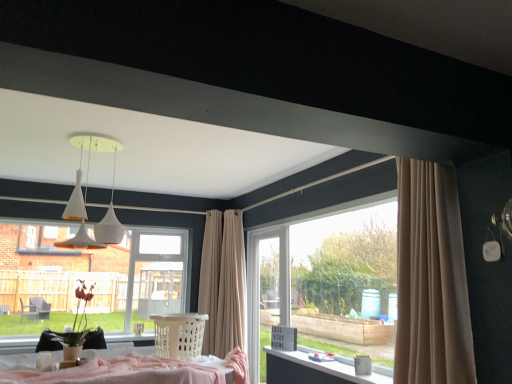
Identify the location of clear glass window at center. The width and height of the screenshot is (512, 384). (89, 278).

This screenshot has height=384, width=512. Describe the element at coordinates (223, 282) in the screenshot. I see `beige fabric curtain at center` at that location.

The image size is (512, 384). Find the location of `white plastic laundry basket at center`. white plastic laundry basket at center is located at coordinates (179, 335).

Looking at this image, what is the approximate width of white glossy table at lower right?

The width of white glossy table at lower right is 9.20 inches.

You are a GUI agent. You are given a task and a screenshot of the screen. Output one action in this format:
    pyautogui.click(x=<x>, y=<y>)
    Task: Click on the clear glass window at center
    The height and width of the screenshot is (384, 512).
    Given the screenshot: What is the action you would take?
    pyautogui.click(x=89, y=278)

From the image's perspective, is white plastic laundry basket at center on clear glass window at center?

No, from the image's perspective, white plastic laundry basket at center is not over clear glass window at center.

Consider the image. Which of these two, white plastic laundry basket at center or clear glass window at center, is bigger?

clear glass window at center is bigger.

Does white plastic laundry basket at center have a greater height compared to clear glass window at center?

No, white plastic laundry basket at center is not taller than clear glass window at center.

Is white plastic laundry basket at center looking in the opposite direction of clear glass window at center?

Absolutely, white plastic laundry basket at center is directed away from clear glass window at center.

Is white glossy table at lower right not near white plastic laundry basket at center?

Yes.

From the image's perspective, between white glossy table at lower right and white plastic laundry basket at center, who is located below?

white glossy table at lower right, from the image's perspective.

Is point (378, 378) positioned behind point (176, 347)?

No, (378, 378) is closer to viewer.

Consider the image. Would you say beige fabric curtain at center is outside white matte pendant lights at upper center?

That's correct, beige fabric curtain at center is outside of white matte pendant lights at upper center.

What's the angular difference between beige fabric curtain at center and white matte pendant lights at upper center's facing directions?

87.7 degrees.

From a real-world perspective, is beige fabric curtain at center above or below white matte pendant lights at upper center?

In terms of real-world spatial position, beige fabric curtain at center is below white matte pendant lights at upper center.

Who is taller, beige fabric curtain at center or white matte pendant lights at upper center?

With more height is beige fabric curtain at center.

Between white matte pendant lights at upper center and white glossy screen door at center, which one has larger size?

Answer: white matte pendant lights at upper center.

Can you confirm if white matte pendant lights at upper center is shorter than white glossy screen door at center?

Yes, white matte pendant lights at upper center is shorter than white glossy screen door at center.

In the scene shown: How different are the orientations of white matte pendant lights at upper center and white glossy screen door at center in degrees?

88.7 degrees separate the facing orientations of white matte pendant lights at upper center and white glossy screen door at center.

Would you say white matte pendant lights at upper center is to the left or to the right of white glossy screen door at center in the picture?

white matte pendant lights at upper center is to the left of white glossy screen door at center.

Is the surface of white glossy screen door at center in direct contact with white matte pendant lights at upper center?

There is a gap between white glossy screen door at center and white matte pendant lights at upper center.

At what (x,y) coordinates should I click in order to perform the action: click on screen door lying behind the white matte pendant lights at upper center. Please return your answer as a coordinate pair (x, y). Looking at the image, I should click on (262, 288).

Would you say white matte pendant lights at upper center is part of white glossy screen door at center's contents?

No, white matte pendant lights at upper center is not inside white glossy screen door at center.

From a real-world perspective, which object rests below the other?

In real-world perspective, white glossy screen door at center is lower.

Does clear glass window at center have a larger size compared to white plastic laundry basket at center?

Yes, clear glass window at center is bigger than white plastic laundry basket at center.

Is clear glass window at center touching white plastic laundry basket at center?

No.

Which object is thinner, clear glass window at center or white plastic laundry basket at center?

Thinner between the two is clear glass window at center.

Between white plastic laundry basket at center and beige fabric curtain at center, which one appears on the right side from the viewer's perspective?

From the viewer's perspective, beige fabric curtain at center appears more on the right side.

How much distance is there between white plastic laundry basket at center and beige fabric curtain at center?

white plastic laundry basket at center is 4.66 feet from beige fabric curtain at center.

Is point (183, 317) in front of point (240, 258)?

Yes, point (183, 317) is in front of point (240, 258).

Is white plastic laundry basket at center inside or outside of beige fabric curtain at center?

white plastic laundry basket at center exists outside the volume of beige fabric curtain at center.

The image size is (512, 384). Find the location of `furniture below the clear glass window at center (from the image's perspective)`. furniture below the clear glass window at center (from the image's perspective) is located at coordinates (179, 335).

This screenshot has width=512, height=384. Identify the location of table on the right of white plastic laundry basket at center. (317, 369).

When comparing their distances from beige fabric curtain at center, does white glossy screen door at center or white glossy table at lower right seem closer?

white glossy screen door at center is positioned closer to the anchor beige fabric curtain at center.

Which object lies nearer to the anchor point beige fabric curtain at center, clear glass window at center or white glossy screen door at center?

Among the two, white glossy screen door at center is located nearer to beige fabric curtain at center.

Estimate the real-world distances between objects in this image. Which object is further from white plastic laundry basket at center, white glossy screen door at center or beige fabric curtain at center?

Based on the image, beige fabric curtain at center appears to be further to white plastic laundry basket at center.

When comparing their distances from white plastic laundry basket at center, does beige fabric curtain at center or white glossy table at lower right seem closer?

white glossy table at lower right lies closer to white plastic laundry basket at center than the other object.

Considering their positions, is white plastic laundry basket at center positioned further to clear glass window at center than beige fabric curtain at center?

beige fabric curtain at center.

Estimate the real-world distances between objects in this image. Which object is closer to white glossy table at lower right, white plastic laundry basket at center or clear glass window at center?

The object closer to white glossy table at lower right is white plastic laundry basket at center.

Based on their spatial positions, is white plastic laundry basket at center or white glossy table at lower right further from beige fabric curtain at center?

white plastic laundry basket at center.

Based on their spatial positions, is beige fabric curtain at center or white matte pendant lights at upper center further from clear glass window at center?

beige fabric curtain at center is further to clear glass window at center.

This screenshot has height=384, width=512. In order to click on screen door between clear glass window at center and white glossy table at lower right in the horizontal direction in this screenshot , I will do `click(262, 288)`.

The width and height of the screenshot is (512, 384). In order to click on screen door between white matte pendant lights at upper center and beige fabric curtain at center from front to back in this screenshot , I will do [262, 288].

Identify the location of furniture between white glossy table at lower right and white glossy screen door at center in the front-back direction. The height and width of the screenshot is (384, 512). (179, 335).

This screenshot has height=384, width=512. What are the coordinates of `furniture between white glossy table at lower right and beige fabric curtain at center from front to back` in the screenshot? It's located at (179, 335).